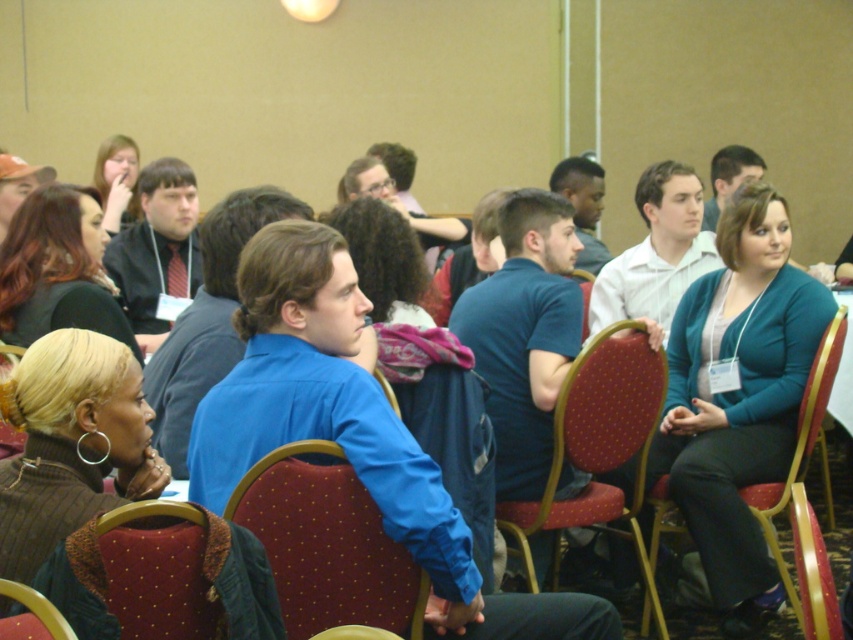
In the conference room scene, you see a maroon fabric chair at center and a matte black jacket at upper left. Which object is positioned more to the left side of the scene?

The matte black jacket at upper left is positioned more to the left side of the scene compared to the maroon fabric chair at center.